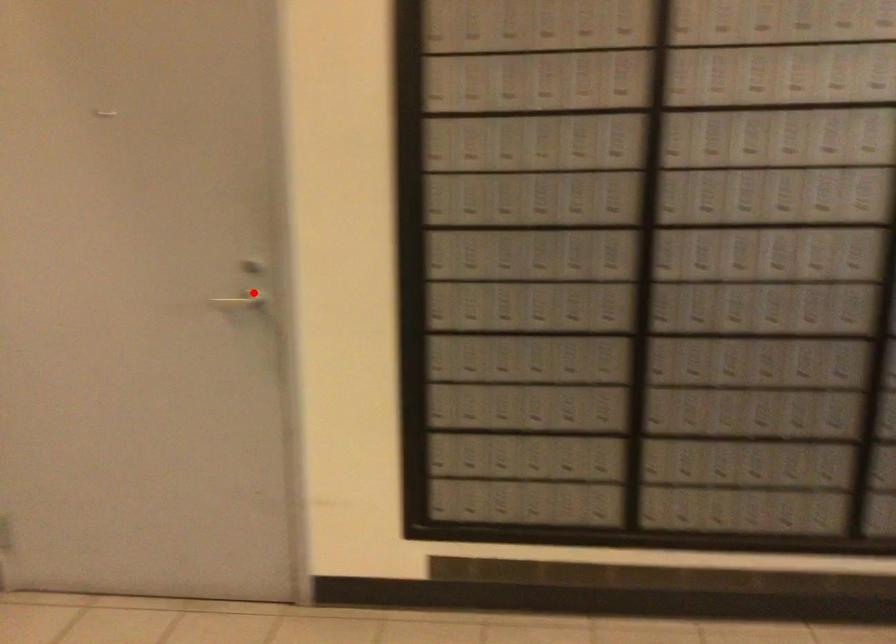
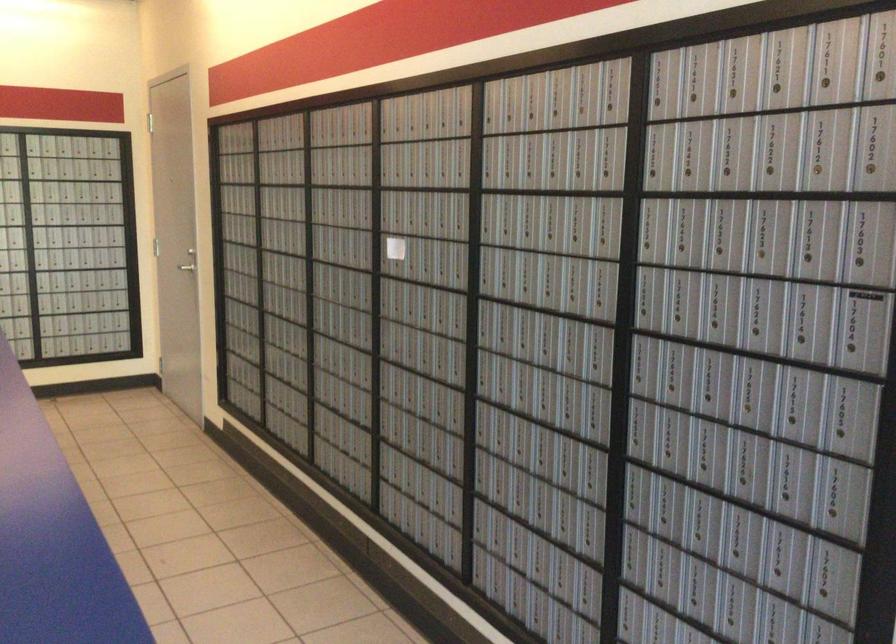
Question: I am providing you with two images of the same scene from different viewpoints. A red point is marked on the first image. Can you still see the location of the red point in image 2?

Choices:
 (A) Yes
 (B) No

Answer: (A)